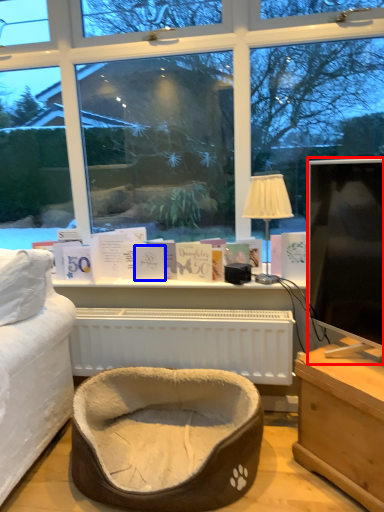
Question: Which object appears farthest to the camera in this image, television (highlighted by a red box) or book (highlighted by a blue box)?

Choices:
 (A) television
 (B) book

Answer: (B)